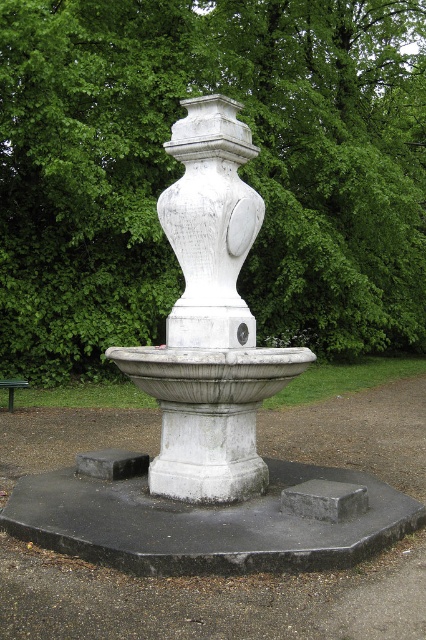
You are a photographer setting up a shot of the fountain. You need to position your tripod so that both the green leafy tree at upper center and the green metallic park bench at lower left are in the frame. Based on their widths, which object should you ensure has more space allocated in your composition?

The green leafy tree at upper center might be wider than the green metallic park bench at lower left, so you should allocate more space for the green leafy tree at upper center in your composition to ensure it fits properly.